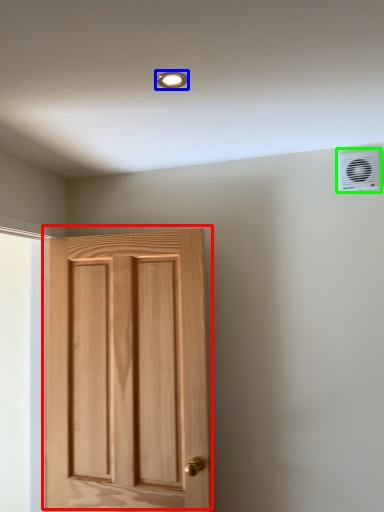
Question: Which object is positioned closest to door (highlighted by a red box)? Select from light fixture (highlighted by a blue box) and air conditioning (highlighted by a green box).

Choices:
 (A) light fixture
 (B) air conditioning

Answer: (B)